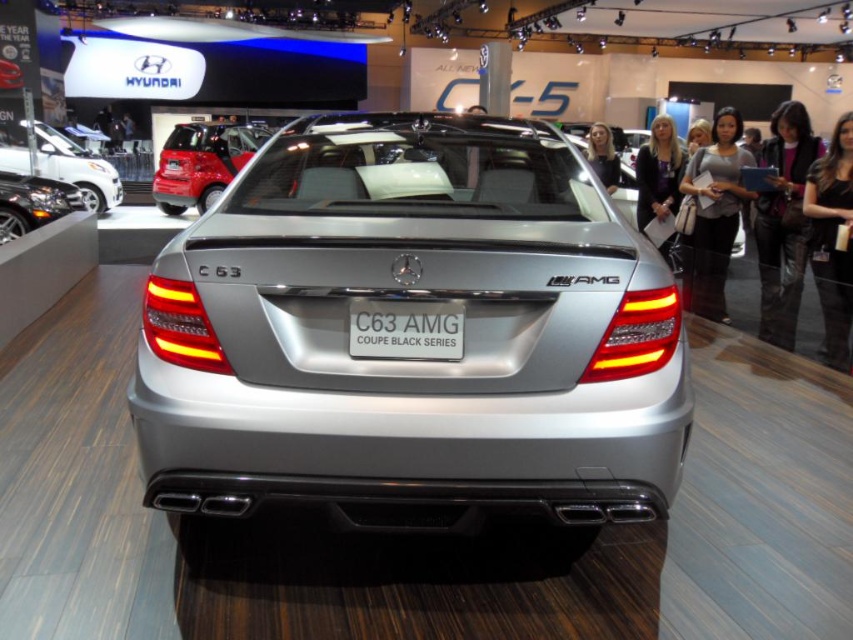
Is point (374, 269) behind point (27, 224)?

No, it is in front of (27, 224).

Is point (181, 237) farther from camera compared to point (20, 227)?

No, (181, 237) is closer to viewer.

Locate an element on the screen. satin silver car at center is located at coordinates (413, 358).

Which is in front, point (189, 170) or point (38, 196)?

Point (38, 196) is in front.

Does shiny red car at upper left have a lesser width compared to polished chrome engine at lower left?

No.

Find the location of a particular element. This screenshot has height=640, width=853. shiny red car at upper left is located at coordinates (202, 163).

Is point (396, 310) in front of point (74, 208)?

Yes, point (396, 310) is in front of point (74, 208).

Does black metallic license plate at center have a greater width compared to polished chrome engine at lower left?

Incorrect, black metallic license plate at center's width does not surpass polished chrome engine at lower left's.

Is point (376, 301) positioned before point (1, 237)?

Yes, point (376, 301) is closer to viewer.

Identify the location of black metallic license plate at center. This screenshot has height=640, width=853. (405, 330).